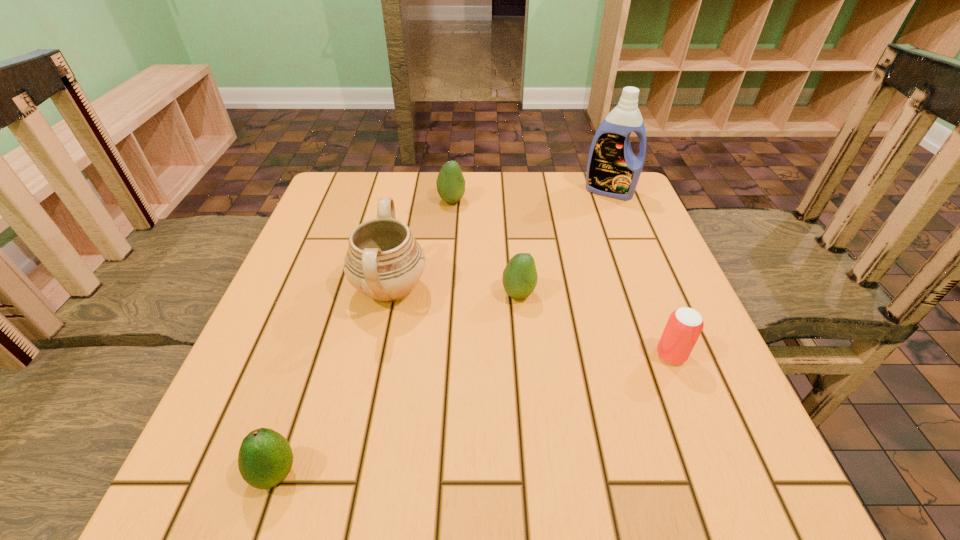
The width and height of the screenshot is (960, 540). In order to click on free space between the tallest object and the second avocado from left to right in this screenshot , I will do `click(530, 196)`.

Find the location of a particular element. This screenshot has height=540, width=960. free space between the farthest avocado and the beer can is located at coordinates (562, 278).

Locate an element on the screen. This screenshot has height=540, width=960. free space that is in between the second avocado from right to left and the tallest object is located at coordinates coord(530,196).

The height and width of the screenshot is (540, 960). What are the coordinates of `free spot between the urn and the tallest object` in the screenshot? It's located at (499, 240).

Find the location of a particular element. vacant space that's between the beer can and the detergent is located at coordinates (640, 273).

This screenshot has height=540, width=960. What are the coordinates of `vacant space that is in between the detergent and the second nearest object` in the screenshot? It's located at (640, 273).

Locate an element on the screen. This screenshot has height=540, width=960. vacant space that is in between the beer can and the second avocado from left to right is located at coordinates pyautogui.click(x=562, y=278).

Where is `free point between the second farthest avocado and the urn`? The width and height of the screenshot is (960, 540). free point between the second farthest avocado and the urn is located at coordinates (454, 292).

You are a GUI agent. You are given a task and a screenshot of the screen. Output one action in this format:
    pyautogui.click(x=<x>, y=<y>)
    Task: Click on the vacant area between the nearest avocado and the detergent
    The height and width of the screenshot is (540, 960).
    Given the screenshot: What is the action you would take?
    pyautogui.click(x=443, y=332)

Identify the location of unoccupied position between the tallest object and the nearest object. Image resolution: width=960 pixels, height=540 pixels. (443, 332).